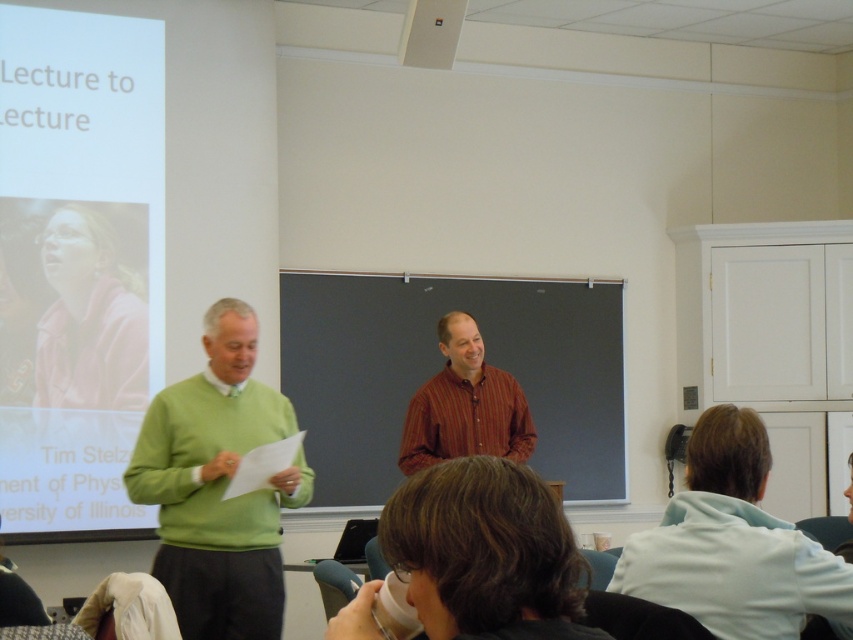
Does point (181, 435) come in front of point (457, 372)?

Yes.

Measure the distance between green sweater at left and camera.

green sweater at left and camera are 3.45 meters apart.

Find the location of `green sweater at left`. green sweater at left is located at coordinates click(x=218, y=486).